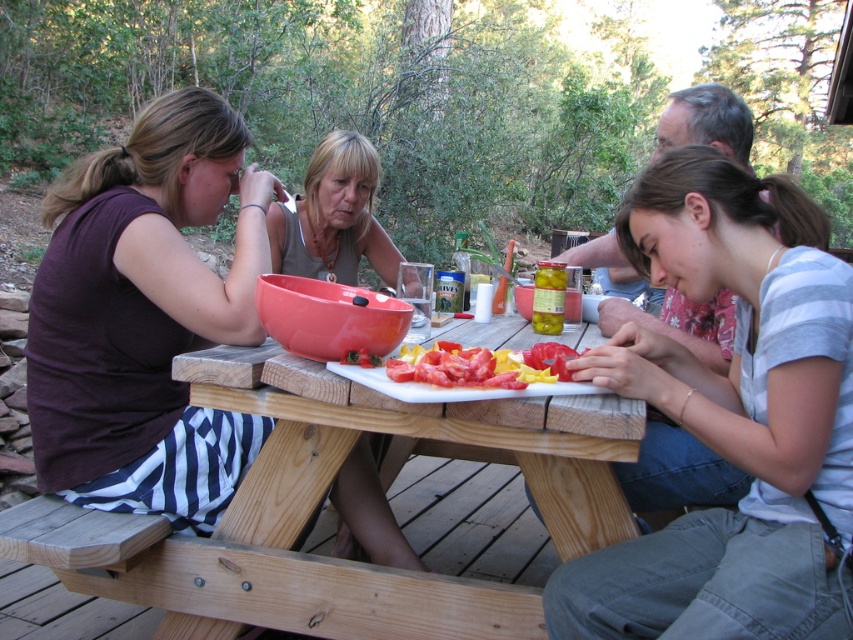
You are standing in front of the wooden picnic table at center and want to grab the sliced red tomato at center. Can you reach it without moving your body?

The wooden picnic table at center is closer to the viewer than the sliced red tomato at center, so you can reach it without moving your body.

You are standing at the center of the image. Which direction should you move to reach the wooden picnic table at center?

The wooden picnic table at center is already at the center of the image, so you don not need to move in any direction to reach it.

Which object is located at the coordinates point (730, 419)?

The point (730, 419) corresponds to the light blue cotton shirt at center.